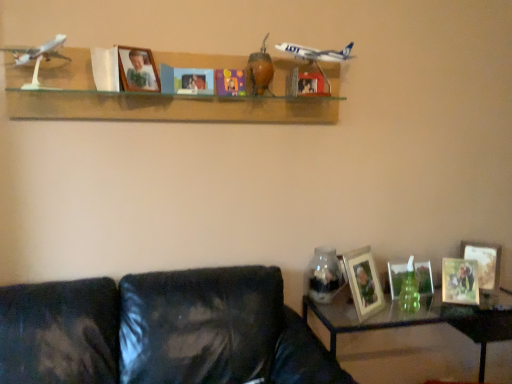
You are a GUI agent. You are given a task and a screenshot of the screen. Output one action in this format:
    pyautogui.click(x=<x>, y=<y>)
    Task: Click on the wooden photo frame at center, which is the third picture frame in left-to-right order
    
    Given the screenshot: What is the action you would take?
    pyautogui.click(x=308, y=82)

Locate an element on the screen. The image size is (512, 384). matte wooden picture frame at center, the 6th picture frame viewed from the right is located at coordinates (186, 80).

The width and height of the screenshot is (512, 384). What do you see at coordinates (186, 80) in the screenshot? I see `matte wooden picture frame at center, the 2th picture frame when ordered from left to right` at bounding box center [186, 80].

This screenshot has height=384, width=512. What do you see at coordinates (484, 262) in the screenshot?
I see `wooden photo frame at lower right, acting as the 1th picture frame starting from the right` at bounding box center [484, 262].

Describe the element at coordinates (460, 281) in the screenshot. The width and height of the screenshot is (512, 384). I see `wooden photo frame at lower right, the second picture frame viewed from the right` at that location.

Measure the distance between point (445,282) and camera.

6.39 feet.

This screenshot has width=512, height=384. Describe the element at coordinates (424, 278) in the screenshot. I see `matte white picture frame at lower right, which is the fifth picture frame from left to right` at that location.

Locate an element on the screen. wooden photo frame at upper center, which is the 7th picture frame in right-to-left order is located at coordinates (138, 70).

Is wooden photo frame at lower right, acting as the 1th picture frame starting from the right, shorter than wooden photo frame at lower right, placed as the fourth picture frame when sorted from left to right?

Incorrect, the height of wooden photo frame at lower right, acting as the 1th picture frame starting from the right, does not fall short of that of wooden photo frame at lower right, placed as the fourth picture frame when sorted from left to right.

Is wooden photo frame at lower right, which ranks as the seventh picture frame in left-to-right order, positioned with its back to wooden photo frame at lower right, positioned as the 4th picture frame in right-to-left order?

No, wooden photo frame at lower right, which ranks as the seventh picture frame in left-to-right order, is not facing the opposite direction of wooden photo frame at lower right, positioned as the 4th picture frame in right-to-left order.

Consider the image. Which object is positioned more to the left, wooden photo frame at lower right, acting as the 1th picture frame starting from the right, or wooden photo frame at lower right, placed as the fourth picture frame when sorted from left to right?

Positioned to the left is wooden photo frame at lower right, placed as the fourth picture frame when sorted from left to right.

Would you say wooden photo frame at lower right, acting as the 1th picture frame starting from the right, is a long distance from wooden photo frame at lower right, placed as the fourth picture frame when sorted from left to right?

No, wooden photo frame at lower right, acting as the 1th picture frame starting from the right, is in close proximity to wooden photo frame at lower right, placed as the fourth picture frame when sorted from left to right.

Is black leather couch at lower left aimed at wooden photo frame at lower right, placed as the fourth picture frame when sorted from left to right?

No, black leather couch at lower left is not aimed at wooden photo frame at lower right, placed as the fourth picture frame when sorted from left to right.

Measure the distance from black leather couch at lower left to wooden photo frame at lower right, positioned as the 4th picture frame in right-to-left order.

black leather couch at lower left and wooden photo frame at lower right, positioned as the 4th picture frame in right-to-left order, are 63.91 centimeters apart.

Identify the location of the 4th picture frame behind the black leather couch at lower left, starting your count from the anchor. [364, 282].

Considering the relative sizes of black leather couch at lower left and wooden photo frame at lower right, placed as the fourth picture frame when sorted from left to right, in the image provided, is black leather couch at lower left bigger than wooden photo frame at lower right, placed as the fourth picture frame when sorted from left to right,?

Yes, black leather couch at lower left is bigger than wooden photo frame at lower right, placed as the fourth picture frame when sorted from left to right.

Is brown matte vase at center with wooden photo frame at lower right, positioned as the 4th picture frame in right-to-left order?

brown matte vase at center and wooden photo frame at lower right, positioned as the 4th picture frame in right-to-left order, are clearly separated.

Considering the sizes of objects brown matte vase at center and wooden photo frame at lower right, placed as the fourth picture frame when sorted from left to right, in the image provided, who is bigger, brown matte vase at center or wooden photo frame at lower right, placed as the fourth picture frame when sorted from left to right,?

wooden photo frame at lower right, placed as the fourth picture frame when sorted from left to right, is bigger.

Does brown matte vase at center turn towards wooden photo frame at lower right, positioned as the 4th picture frame in right-to-left order?

No, brown matte vase at center does not turn towards wooden photo frame at lower right, positioned as the 4th picture frame in right-to-left order.

There is a wooden photo frame at lower right, positioned as the 4th picture frame in right-to-left order. What are the coordinates of `toy above it (from a real-world perspective)` in the screenshot? It's located at (259, 72).

From the image's perspective, relative to black leather couch at lower left, is transparent glass jar at lower right above or below?

transparent glass jar at lower right is above black leather couch at lower left.

Considering the sizes of transparent glass jar at lower right and black leather couch at lower left in the image, is transparent glass jar at lower right bigger or smaller than black leather couch at lower left?

Considering their sizes, transparent glass jar at lower right takes up less space than black leather couch at lower left.

In the scene shown: Is transparent glass jar at lower right oriented towards black leather couch at lower left?

Yes, transparent glass jar at lower right is facing black leather couch at lower left.

Considering the relative positions of transparent glass jar at lower right and black leather couch at lower left in the image provided, is transparent glass jar at lower right to the right of black leather couch at lower left from the viewer's perspective?

Yes, transparent glass jar at lower right is to the right of black leather couch at lower left.

I want to click on glass vase that appears below the wooden photo frame at center, which is the third picture frame in left-to-right order (from a real-world perspective), so click(x=324, y=275).

Is transparent glass jar at lower right turned away from wooden photo frame at center, which is the third picture frame in left-to-right order?

transparent glass jar at lower right is not turned away from wooden photo frame at center, which is the third picture frame in left-to-right order.

Is transparent glass jar at lower right at the right side of wooden photo frame at center, arranged as the fifth picture frame when viewed from the right?

Yes, transparent glass jar at lower right is to the right of wooden photo frame at center, arranged as the fifth picture frame when viewed from the right.

Would you say transparent glass jar at lower right is inside or outside wooden photo frame at center, arranged as the fifth picture frame when viewed from the right?

transparent glass jar at lower right lies outside wooden photo frame at center, arranged as the fifth picture frame when viewed from the right.

Which is closer to the camera, (x=335, y=253) or (x=458, y=298)?

The point (x=458, y=298) is more forward.

Considering the relative positions of transparent glass jar at lower right and wooden photo frame at lower right, the second picture frame viewed from the right, in the image provided, is transparent glass jar at lower right to the left of wooden photo frame at lower right, the second picture frame viewed from the right, from the viewer's perspective?

Yes, transparent glass jar at lower right is to the left of wooden photo frame at lower right, the second picture frame viewed from the right.

Does transparent glass jar at lower right have a lesser height compared to wooden photo frame at lower right, the second picture frame viewed from the right?

No, transparent glass jar at lower right is not shorter than wooden photo frame at lower right, the second picture frame viewed from the right.

Is transparent glass jar at lower right oriented towards wooden photo frame at lower right, the second picture frame viewed from the right?

No, transparent glass jar at lower right is not turned towards wooden photo frame at lower right, the second picture frame viewed from the right.

Considering the sizes of objects transparent glass jar at lower right and wooden photo frame at lower right, positioned as the 4th picture frame in right-to-left order, in the image provided, who is bigger, transparent glass jar at lower right or wooden photo frame at lower right, positioned as the 4th picture frame in right-to-left order,?

With larger size is wooden photo frame at lower right, positioned as the 4th picture frame in right-to-left order.

Considering the sizes of objects transparent glass jar at lower right and wooden photo frame at lower right, placed as the fourth picture frame when sorted from left to right, in the image provided, who is thinner, transparent glass jar at lower right or wooden photo frame at lower right, placed as the fourth picture frame when sorted from left to right,?

transparent glass jar at lower right.

Is transparent glass jar at lower right looking in the opposite direction of wooden photo frame at lower right, placed as the fourth picture frame when sorted from left to right?

No, transparent glass jar at lower right's orientation is not away from wooden photo frame at lower right, placed as the fourth picture frame when sorted from left to right.

Is transparent glass jar at lower right to the right of wooden photo frame at lower right, positioned as the 4th picture frame in right-to-left order, from the viewer's perspective?

Incorrect, transparent glass jar at lower right is not on the right side of wooden photo frame at lower right, positioned as the 4th picture frame in right-to-left order.

Which picture frame is the 3rd one when counting from the left side of the wooden photo frame at lower right, which ranks as the seventh picture frame in left-to-right order? Please provide its 2D coordinates.

[(364, 282)]

This screenshot has width=512, height=384. There is a black leather couch at lower left. What are the coordinates of `the 4th picture frame above it (from a real-world perspective)` in the screenshot? It's located at (364, 282).

Looking at the image, which one is located further to wooden photo frame at lower right, positioned as the 4th picture frame in right-to-left order, black leather couch at lower left or wooden photo frame at lower right, which ranks as the seventh picture frame in left-to-right order?

Based on the image, black leather couch at lower left appears to be further to wooden photo frame at lower right, positioned as the 4th picture frame in right-to-left order.

In the scene shown: Considering their positions, is wooden photo frame at lower right, positioned as the 4th picture frame in right-to-left order, positioned closer to matte wooden picture frame at center, the 6th picture frame viewed from the right, than matte white picture frame at lower right, the third picture frame when ordered from right to left?

wooden photo frame at lower right, positioned as the 4th picture frame in right-to-left order, lies closer to matte wooden picture frame at center, the 6th picture frame viewed from the right, than the other object.

Which object lies further to the anchor point wooden photo frame at lower right, placed as the fourth picture frame when sorted from left to right, matte wooden picture frame at center, the 6th picture frame viewed from the right, or wooden photo frame at center, which is the third picture frame in left-to-right order?

Based on the image, matte wooden picture frame at center, the 6th picture frame viewed from the right, appears to be further to wooden photo frame at lower right, placed as the fourth picture frame when sorted from left to right.

Based on their spatial positions, is wooden shelf at upper center or wooden photo frame at lower right, the second picture frame viewed from the right, closer to matte white picture frame at lower right, which is the fifth picture frame from left to right?

wooden photo frame at lower right, the second picture frame viewed from the right.

Which object lies nearer to the anchor point wooden shelf at upper center, matte wooden picture frame at center, the 2th picture frame when ordered from left to right, or transparent glass jar at lower right?

matte wooden picture frame at center, the 2th picture frame when ordered from left to right, is positioned closer to the anchor wooden shelf at upper center.

Estimate the real-world distances between objects in this image. Which object is closer to wooden photo frame at lower right, which ranks as the sixth picture frame in left-to-right order, wooden photo frame at lower right, placed as the fourth picture frame when sorted from left to right, or matte wooden picture frame at center, the 6th picture frame viewed from the right?

wooden photo frame at lower right, placed as the fourth picture frame when sorted from left to right, is closer to wooden photo frame at lower right, which ranks as the sixth picture frame in left-to-right order.

Based on their spatial positions, is brown matte vase at center or wooden photo frame at lower right, which ranks as the seventh picture frame in left-to-right order, further from clear glass table at lower right?

Based on the image, brown matte vase at center appears to be further to clear glass table at lower right.

Considering their positions, is clear glass table at lower right positioned further to wooden photo frame at lower right, positioned as the 4th picture frame in right-to-left order, than wooden photo frame at upper center, which is the 7th picture frame in right-to-left order?

The object further to wooden photo frame at lower right, positioned as the 4th picture frame in right-to-left order, is wooden photo frame at upper center, which is the 7th picture frame in right-to-left order.

This screenshot has height=384, width=512. I want to click on glass vase between matte wooden picture frame at center, the 6th picture frame viewed from the right, and wooden photo frame at lower right, which ranks as the seventh picture frame in left-to-right order, so click(x=324, y=275).

Locate an element on the screen. This screenshot has width=512, height=384. glass vase between matte wooden picture frame at center, the 2th picture frame when ordered from left to right, and clear glass table at lower right, in the vertical direction is located at coordinates (324, 275).

Locate an element on the screen. shelf between wooden photo frame at upper center, which is the 7th picture frame in right-to-left order, and black leather couch at lower left, in the vertical direction is located at coordinates (163, 98).

Identify the location of shelf between wooden photo frame at upper center, which is the 7th picture frame in right-to-left order, and clear glass table at lower right, in the vertical direction. (163, 98).